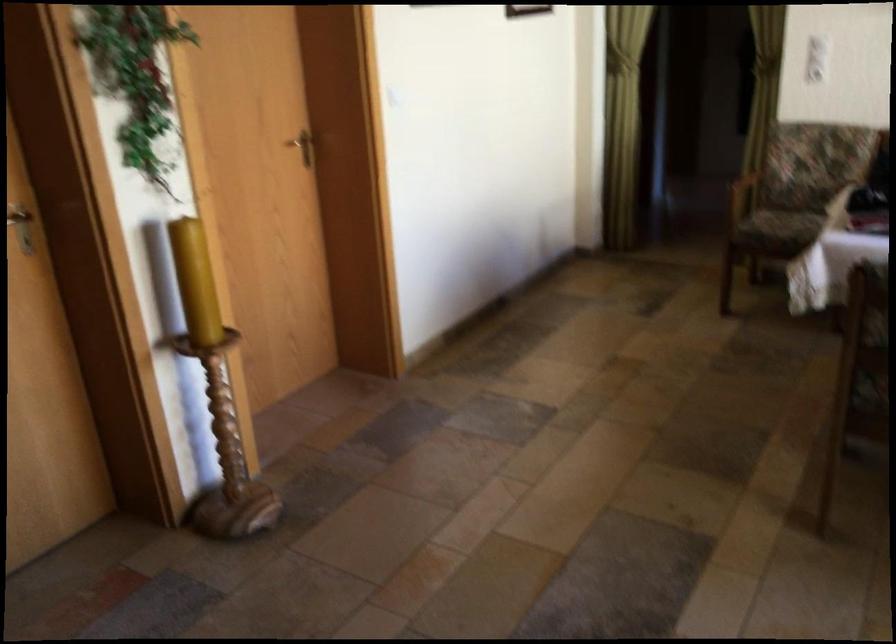
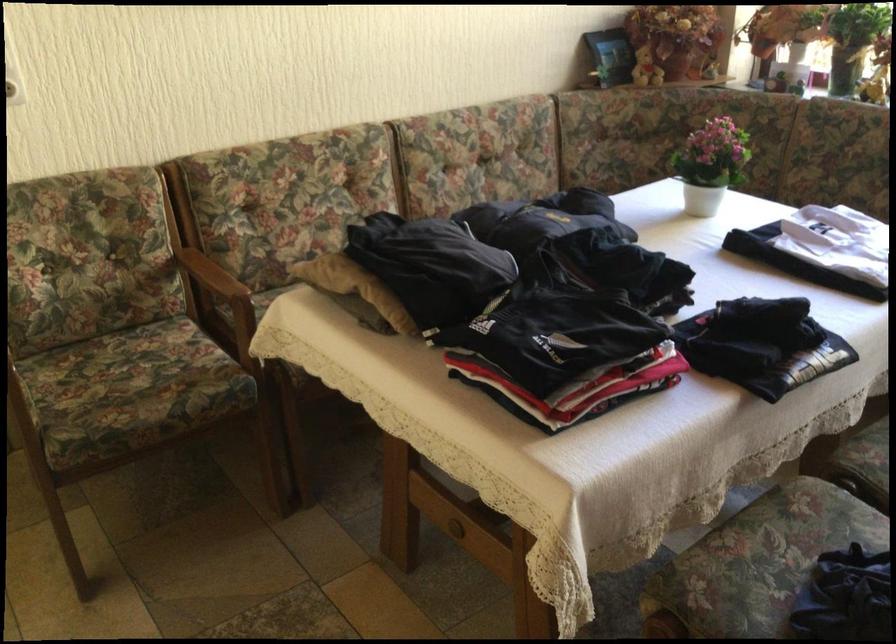
The point at [786,221] is marked in the first image. Where is the corresponding point in the second image?

(130, 383)